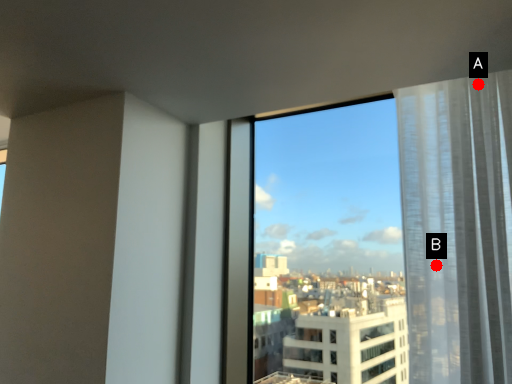
Question: Two points are circled on the image, labeled by A and B beside each circle. Which of the following is the farthest from the observer?

Choices:
 (A) A is further
 (B) B is further

Answer: (A)